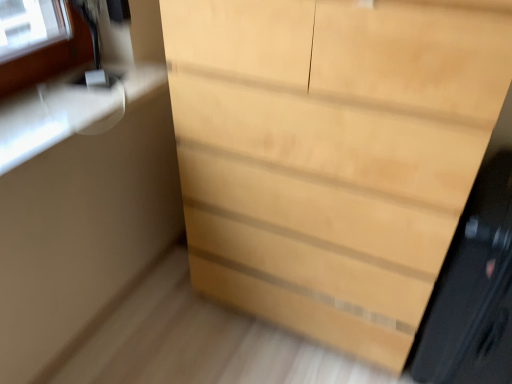
Question: From a real-world perspective, is light wood chest of drawers at center physically located above or below black glossy screen door at right?

Choices:
 (A) below
 (B) above

Answer: (B)

Question: In terms of size, does light wood chest of drawers at center appear bigger or smaller than black glossy screen door at right?

Choices:
 (A) small
 (B) big

Answer: (B)

Question: Considering the positions of light wood chest of drawers at center and black glossy screen door at right in the image, is light wood chest of drawers at center wider or thinner than black glossy screen door at right?

Choices:
 (A) wide
 (B) thin

Answer: (B)

Question: Is point (482, 307) closer or farther from the camera than point (221, 102)?

Choices:
 (A) farther
 (B) closer

Answer: (B)

Question: Is black glossy screen door at right wider or thinner than light wood chest of drawers at center?

Choices:
 (A) thin
 (B) wide

Answer: (B)

Question: Would you say black glossy screen door at right is inside or outside light wood chest of drawers at center?

Choices:
 (A) outside
 (B) inside

Answer: (A)

Question: From the image's perspective, is black glossy screen door at right positioned above or below light wood chest of drawers at center?

Choices:
 (A) above
 (B) below

Answer: (B)